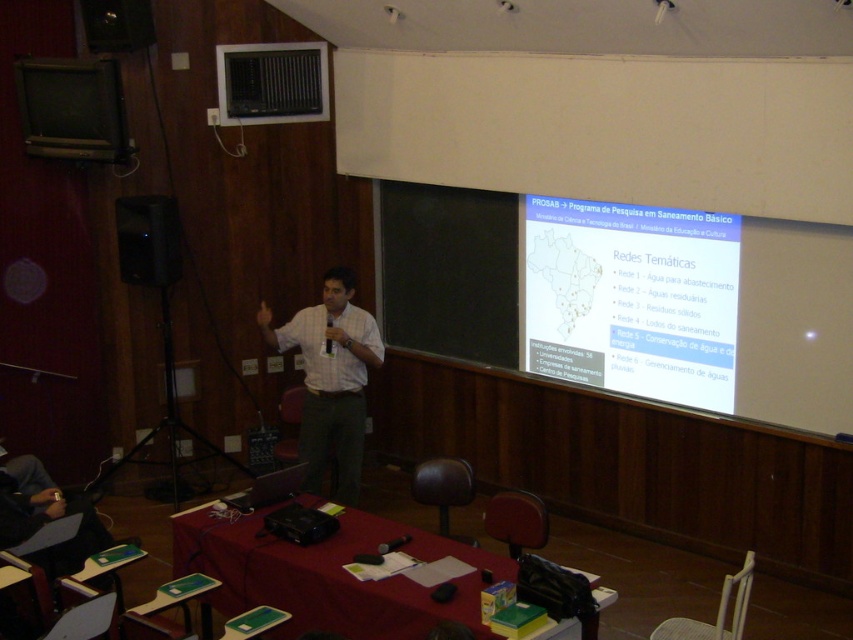
Does white matte projection screen at upper right have a larger size compared to black matte speaker at left?

Yes.

Between white matte projection screen at upper right and black matte speaker at left, which one is positioned lower?

Positioned lower is white matte projection screen at upper right.

This screenshot has height=640, width=853. I want to click on white matte projection screen at upper right, so click(x=633, y=298).

At what (x,y) coordinates should I click in order to perform the action: click on white matte projection screen at upper right. Please return your answer as a coordinate pair (x, y). Looking at the image, I should click on (633, 298).

Does white matte projection screen at upper right appear on the right side of white shirt at center?

Yes, white matte projection screen at upper right is to the right of white shirt at center.

Which is below, white matte projection screen at upper right or white shirt at center?

Positioned lower is white shirt at center.

Describe the element at coordinates (633, 298) in the screenshot. This screenshot has width=853, height=640. I see `white matte projection screen at upper right` at that location.

Where is `white matte projection screen at upper right`? Image resolution: width=853 pixels, height=640 pixels. white matte projection screen at upper right is located at coordinates (633, 298).

Can you confirm if black matte speaker at left is bigger than matte black speaker at upper left?

Yes, black matte speaker at left is bigger than matte black speaker at upper left.

Who is more forward, (x=164, y=276) or (x=106, y=33)?

Point (x=106, y=33) is in front.

Locate an element on the screen. The width and height of the screenshot is (853, 640). black matte speaker at left is located at coordinates (148, 240).